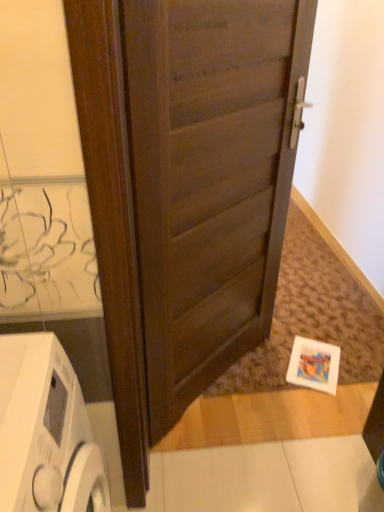
Question: From a real-world perspective, does dark wood door at center sit lower than white glossy washing machine at lower left?

Choices:
 (A) no
 (B) yes

Answer: (A)

Question: Is white glossy washing machine at lower left a part of dark wood door at center?

Choices:
 (A) no
 (B) yes

Answer: (A)

Question: Does dark wood door at center appear on the right side of white glossy washing machine at lower left?

Choices:
 (A) yes
 (B) no

Answer: (A)

Question: Is dark wood door at center not within white glossy washing machine at lower left?

Choices:
 (A) no
 (B) yes

Answer: (B)

Question: Is dark wood door at center oriented towards white glossy washing machine at lower left?

Choices:
 (A) yes
 (B) no

Answer: (B)

Question: Does dark wood door at center have a larger size compared to white glossy washing machine at lower left?

Choices:
 (A) yes
 (B) no

Answer: (A)

Question: Does white glossy washing machine at lower left have a smaller size compared to dark wood door at center?

Choices:
 (A) yes
 (B) no

Answer: (A)

Question: Is white glossy washing machine at lower left placed right next to dark wood door at center?

Choices:
 (A) yes
 (B) no

Answer: (B)

Question: Can dark wood door at center be found inside white glossy washing machine at lower left?

Choices:
 (A) no
 (B) yes

Answer: (A)

Question: Is dark wood door at center at the back of white glossy washing machine at lower left?

Choices:
 (A) yes
 (B) no

Answer: (B)

Question: Considering the relative sizes of white glossy washing machine at lower left and dark wood door at center in the image provided, is white glossy washing machine at lower left taller than dark wood door at center?

Choices:
 (A) yes
 (B) no

Answer: (B)

Question: Is there a large distance between white glossy washing machine at lower left and dark wood door at center?

Choices:
 (A) yes
 (B) no

Answer: (B)

Question: From the image's perspective, is white glossy washing machine at lower left above or below dark wood door at center?

Choices:
 (A) above
 (B) below

Answer: (B)